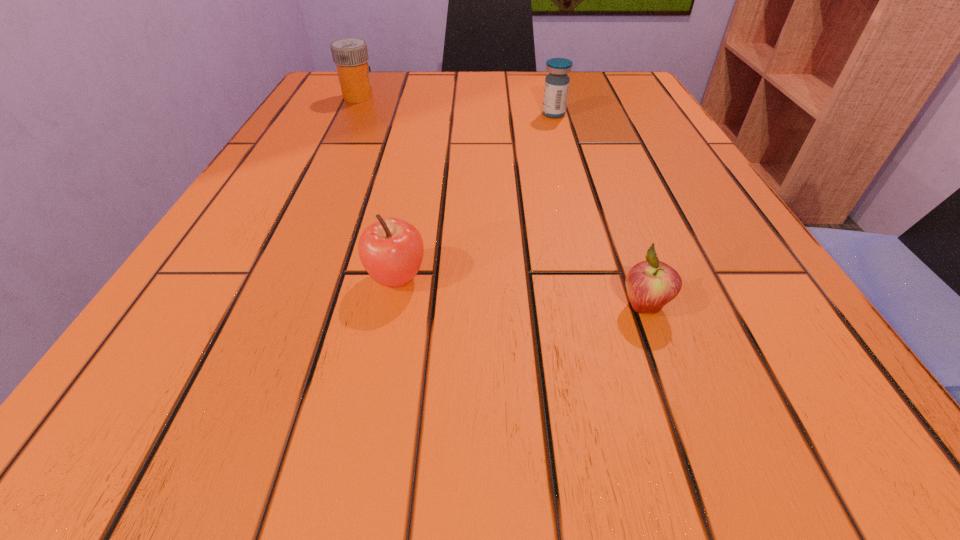
At what (x,y) coordinates should I click in order to perform the action: click on the farther medicine. Please return your answer as a coordinate pair (x, y). Image resolution: width=960 pixels, height=540 pixels. Looking at the image, I should click on (350, 55).

Locate an element on the screen. This screenshot has height=540, width=960. the farthest object is located at coordinates (350, 55).

This screenshot has height=540, width=960. I want to click on the nearer medicine, so click(556, 88).

Find the location of `the right medicine`. the right medicine is located at coordinates (556, 88).

You are a GUI agent. You are given a task and a screenshot of the screen. Output one action in this format:
    pyautogui.click(x=<x>, y=<y>)
    Task: Click on the left apple
    
    Given the screenshot: What is the action you would take?
    pyautogui.click(x=391, y=250)

What are the coordinates of `the right apple` in the screenshot? It's located at (651, 284).

The image size is (960, 540). Identify the location of free region located on the label side of the left medicine. (545, 97).

The width and height of the screenshot is (960, 540). In order to click on vacant region located on the front of the second farthest object in this screenshot , I will do `click(569, 171)`.

This screenshot has width=960, height=540. I want to click on vacant area situated 0.270m on the right of the second object from left to right, so click(638, 278).

At what (x,y) coordinates should I click in order to perform the action: click on free spot located on the back of the right apple. Please return your answer as a coordinate pair (x, y). The image size is (960, 540). Looking at the image, I should click on (615, 225).